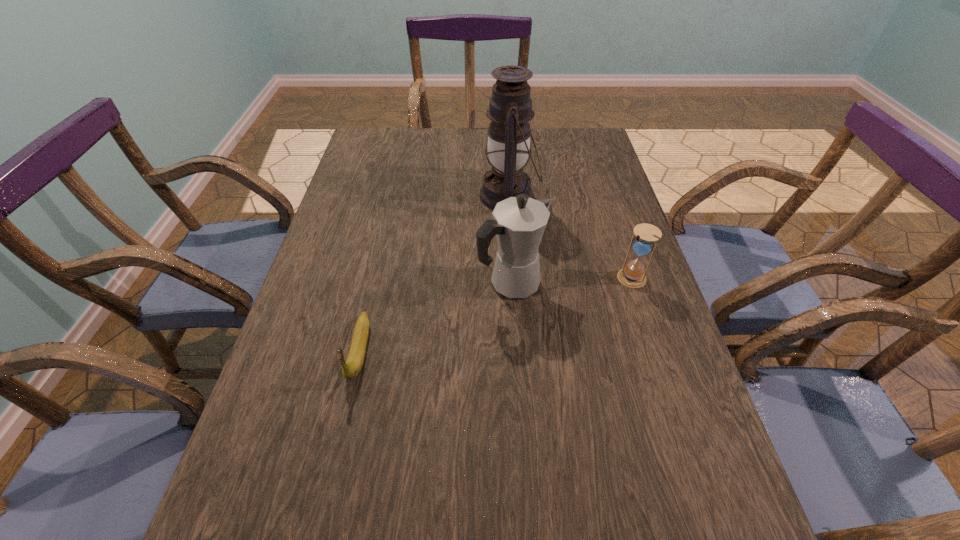
Locate an element on the screen. This screenshot has height=540, width=960. vacant region located at the stem of the shortest object is located at coordinates (318, 534).

Locate an element on the screen. The image size is (960, 540). object situated at the left edge is located at coordinates (351, 368).

Where is `object located in the right edge section of the desktop`? This screenshot has width=960, height=540. object located in the right edge section of the desktop is located at coordinates (632, 275).

In order to click on free space at the far edge of the desktop in this screenshot , I will do `click(433, 160)`.

Locate an element on the screen. vacant space at the left edge of the desktop is located at coordinates (331, 272).

Find the location of `vacant space at the right edge`. vacant space at the right edge is located at coordinates (590, 168).

You are a GUI agent. You are given a task and a screenshot of the screen. Output one action in this format:
    pyautogui.click(x=<x>, y=<y>)
    Task: Click on the vacant region at the far left corner of the desktop
    
    Given the screenshot: What is the action you would take?
    pyautogui.click(x=367, y=161)

In the image, there is a desktop. Where is `free space at the far right corner`? This screenshot has width=960, height=540. free space at the far right corner is located at coordinates [588, 141].

The width and height of the screenshot is (960, 540). In order to click on vacant area that lies between the farthest object and the third tallest object in this screenshot , I will do `click(570, 237)`.

The height and width of the screenshot is (540, 960). I want to click on free space between the banana and the third tallest object, so click(x=495, y=314).